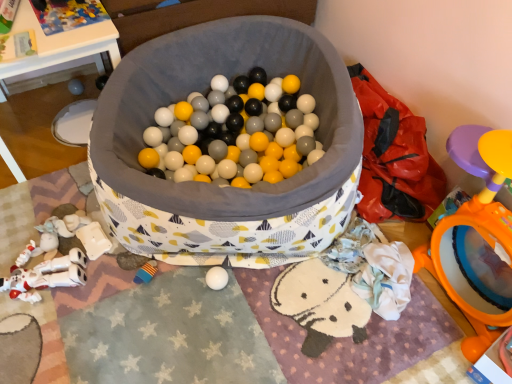
You are a GUI agent. You are given a task and a screenshot of the screen. Output one action in this format:
    pyautogui.click(x=<x>, y=<y>)
    Task: Click on the empty space that is in between white plush toy at lower left, arranged as the 2th toy when viewed from the front, and soft plush toy at lower left, positioned as the fourth toy in left-to-right order
    
    Given the screenshot: What is the action you would take?
    pyautogui.click(x=105, y=278)